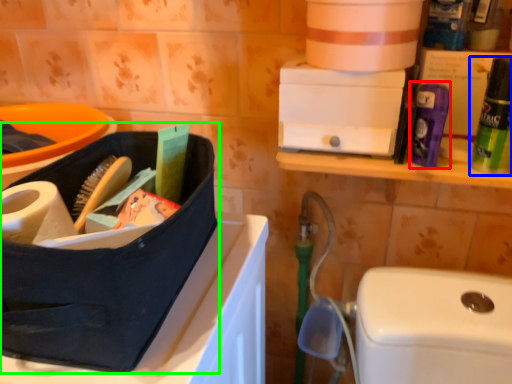
Question: Estimate the real-world distances between objects in this image. Which object is farther from cleaning product (highlighted by a red box), cleaning product (highlighted by a blue box) or lunch box (highlighted by a green box)?

Choices:
 (A) cleaning product
 (B) lunch box

Answer: (B)